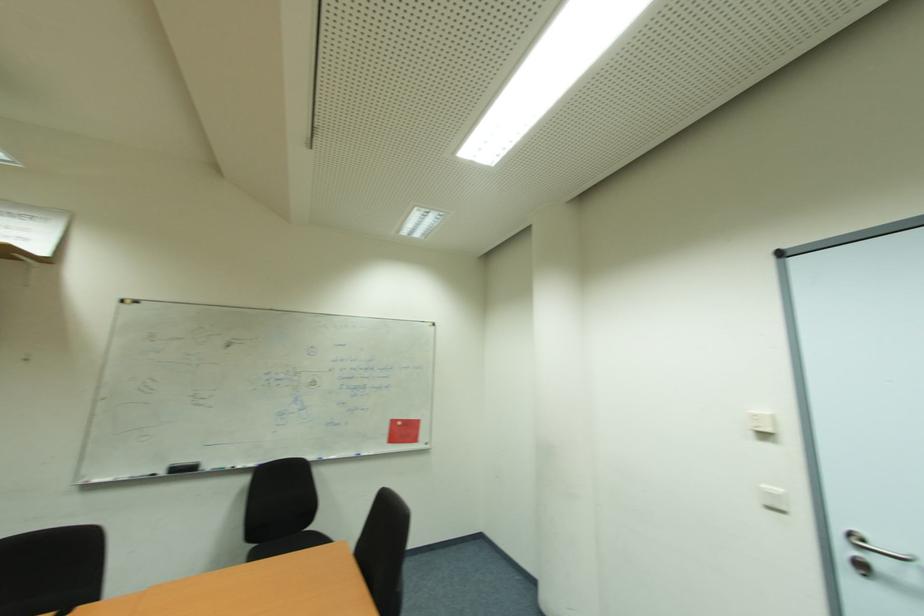
The width and height of the screenshot is (924, 616). I want to click on white light switch, so click(x=773, y=499).